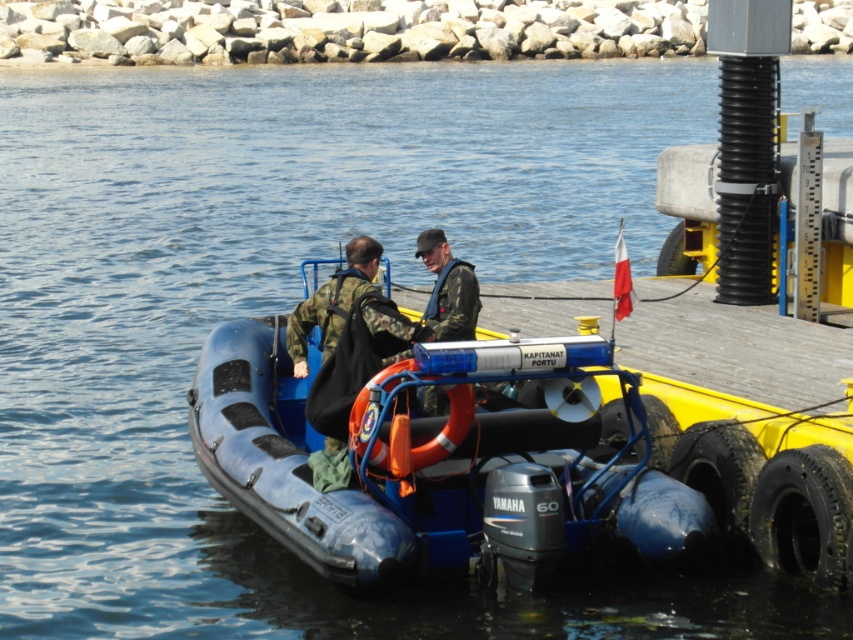
Question: Which object is farther from the camera taking this photo?

Choices:
 (A) orange rubber life jacket at center
 (B) blue rubber boat at center

Answer: (A)

Question: Can you confirm if blue rubber boat at center is positioned above orange rubber life jacket at center?

Choices:
 (A) no
 (B) yes

Answer: (B)

Question: Can you confirm if blue rubber boat at center is wider than orange rubber life jacket at center?

Choices:
 (A) yes
 (B) no

Answer: (A)

Question: Is the position of blue rubber boat at center less distant than that of orange rubber life jacket at center?

Choices:
 (A) no
 (B) yes

Answer: (B)

Question: Which object is closer to the camera taking this photo?

Choices:
 (A) orange rubber life jacket at center
 (B) blue rubber boat at center

Answer: (B)